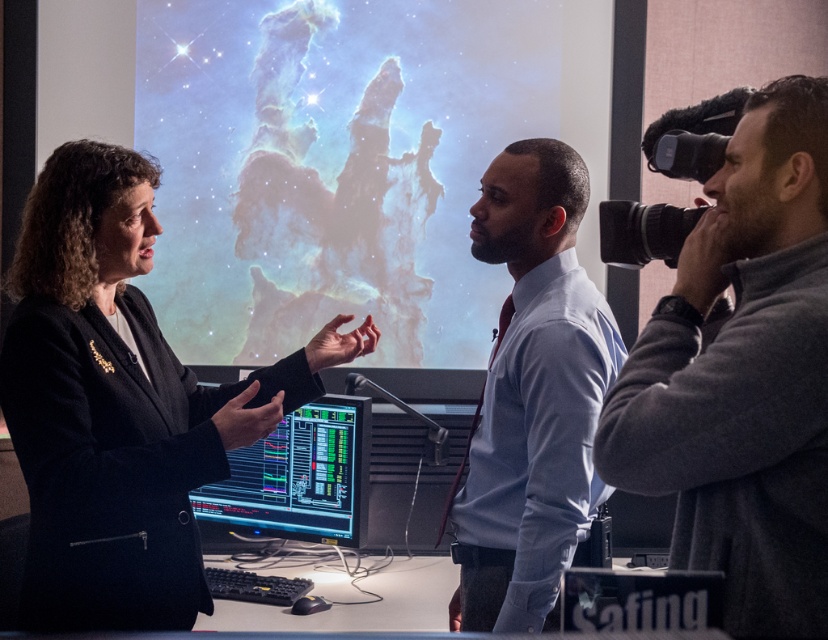
You are an assistant in the control room and need to locate the gray fleece jacket at right and the shiny black monitor at center. Which object is positioned higher in the image?

The gray fleece jacket at right is located above the shiny black monitor at center, so it is positioned higher.

You are an event organizer who needs to arrange seating for two attendees based on their clothing. You have two chairs available. The first chair is for the attendee wearing the gray fleece jacket at right, and the second chair is for the one in the light blue shirt at center. Which attendee requires a larger chair due to their clothing size?

The light blue shirt at center requires a larger chair because the gray fleece jacket at right occupies less space, indicating the light blue shirt attendee needs more seating space.

You are an attendee at this presentation. You notice the light blue shirt at center and the shiny black monitor at center. Which object takes up more space horizontally in the image?

The shiny black monitor at center takes up more space horizontally than the light blue shirt at center because the light blue shirt at center has a lesser width compared to the shiny black monitor at center.